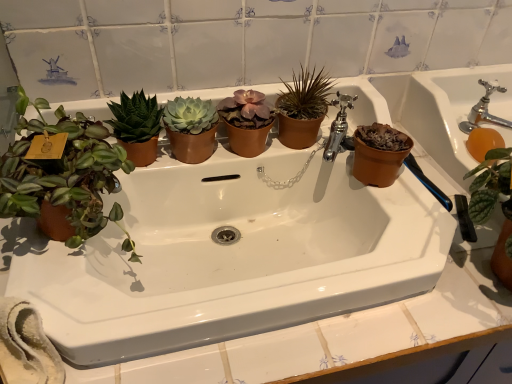
Question: From the image's perspective, would you say terracotta pot at right is shown under white ceramic sink at center?

Choices:
 (A) yes
 (B) no

Answer: (B)

Question: Is terracotta pot at right not close to white ceramic sink at center?

Choices:
 (A) yes
 (B) no

Answer: (B)

Question: Considering the relative positions of terracotta pot at right and white ceramic sink at center in the image provided, is terracotta pot at right to the right of white ceramic sink at center from the viewer's perspective?

Choices:
 (A) yes
 (B) no

Answer: (A)

Question: From a real-world perspective, is terracotta pot at right physically above white ceramic sink at center?

Choices:
 (A) no
 (B) yes

Answer: (A)

Question: Is terracotta pot at right taller than white ceramic sink at center?

Choices:
 (A) no
 (B) yes

Answer: (B)

Question: From the image's perspective, is green matte succulent at upper center, the second houseplant in the left-to-right sequence, above or below terracotta pot at right?

Choices:
 (A) below
 (B) above

Answer: (B)

Question: Considering the positions of green matte succulent at upper center, positioned as the 2th houseplant in right-to-left order, and terracotta pot at right in the image, is green matte succulent at upper center, positioned as the 2th houseplant in right-to-left order, taller or shorter than terracotta pot at right?

Choices:
 (A) tall
 (B) short

Answer: (B)

Question: Is green matte succulent at upper center, positioned as the 2th houseplant in right-to-left order, in front of or behind terracotta pot at right in the image?

Choices:
 (A) behind
 (B) front

Answer: (A)

Question: Considering the positions of point (141, 119) and point (390, 107), is point (141, 119) closer or farther from the camera than point (390, 107)?

Choices:
 (A) closer
 (B) farther

Answer: (A)

Question: In the image, is brown terracotta pot at right on the left side or the right side of terracotta pot at right?

Choices:
 (A) right
 (B) left

Answer: (B)

Question: In the image, is brown terracotta pot at right positioned in front of or behind terracotta pot at right?

Choices:
 (A) front
 (B) behind

Answer: (B)

Question: In terms of width, does brown terracotta pot at right look wider or thinner when compared to terracotta pot at right?

Choices:
 (A) wide
 (B) thin

Answer: (B)

Question: Is point (353, 163) closer or farther from the camera than point (473, 81)?

Choices:
 (A) farther
 (B) closer

Answer: (B)

Question: In terms of height, does silver metallic faucet at upper right, which is the first tap in right-to-left order, look taller or shorter compared to matte brown pot at left, the 1th houseplant from the left?

Choices:
 (A) short
 (B) tall

Answer: (A)

Question: Is point (486, 97) closer or farther from the camera than point (89, 145)?

Choices:
 (A) farther
 (B) closer

Answer: (A)